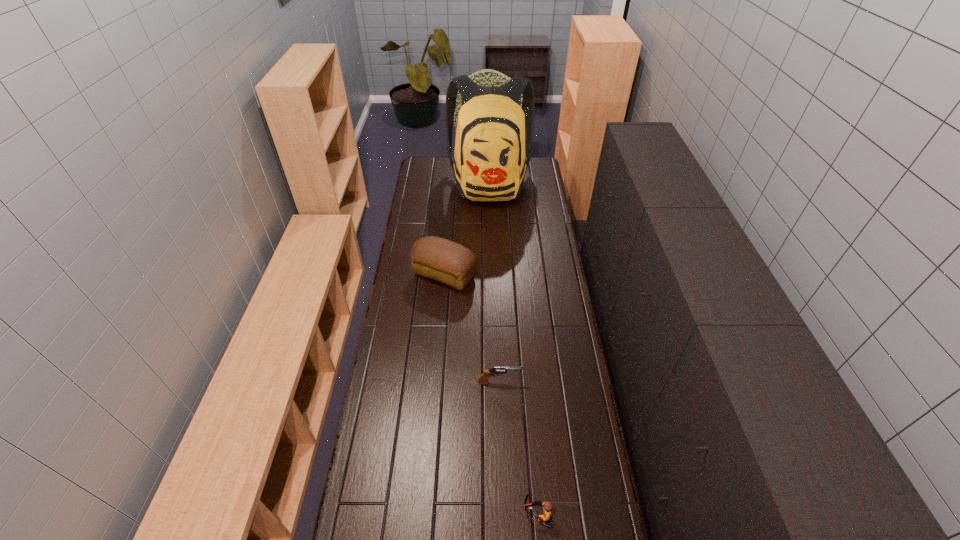
Locate an element on the screen. The width and height of the screenshot is (960, 540). free point between the third nearest object and the Lego is located at coordinates (491, 394).

Where is `free spot between the bread and the second nearest object`? The image size is (960, 540). free spot between the bread and the second nearest object is located at coordinates (472, 328).

Locate an element on the screen. This screenshot has height=540, width=960. vacant space that's between the backpack and the gun is located at coordinates (494, 283).

In order to click on vacant space that is in between the gun and the second tallest object in this screenshot , I will do `click(472, 328)`.

Where is `vacant space in between the gun and the tallest object`? The height and width of the screenshot is (540, 960). vacant space in between the gun and the tallest object is located at coordinates (494, 283).

Where is `unoccupied position between the backpack and the nearest object`? The width and height of the screenshot is (960, 540). unoccupied position between the backpack and the nearest object is located at coordinates (514, 349).

In order to click on blank region between the bread and the third farthest object in this screenshot , I will do `click(472, 328)`.

Locate an element on the screen. Image resolution: width=960 pixels, height=540 pixels. vacant area between the nearest object and the third nearest object is located at coordinates (491, 394).

Locate an element on the screen. vacant space that is in between the bread and the farthest object is located at coordinates (467, 229).

At what (x,y) coordinates should I click in order to perform the action: click on object that is the second closest to the second nearest object. Please return your answer as a coordinate pair (x, y). The image size is (960, 540). Looking at the image, I should click on (443, 260).